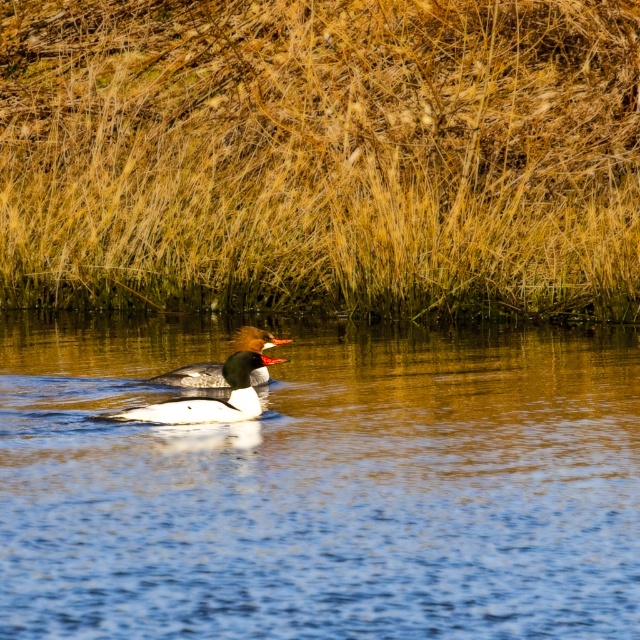
Question: Among these points, which one is farthest from the camera?

Choices:
 (A) [x=164, y=589]
 (B) [x=573, y=253]
 (C) [x=186, y=369]

Answer: (B)

Question: Can you confirm if dry grass at upper center is positioned below shiny brown duck at center?

Choices:
 (A) yes
 (B) no

Answer: (B)

Question: Is dry grass at upper center above blue smooth water at center?

Choices:
 (A) yes
 (B) no

Answer: (A)

Question: Is dry grass at upper center in front of shiny brown duck at center?

Choices:
 (A) no
 (B) yes

Answer: (A)

Question: Which is nearer to the dry grass at upper center?

Choices:
 (A) white glossy duck at center
 (B) shiny brown duck at center

Answer: (B)

Question: Among these objects, which one is nearest to the camera?

Choices:
 (A) white glossy duck at center
 (B) blue smooth water at center
 (C) shiny brown duck at center
 (D) dry grass at upper center

Answer: (B)